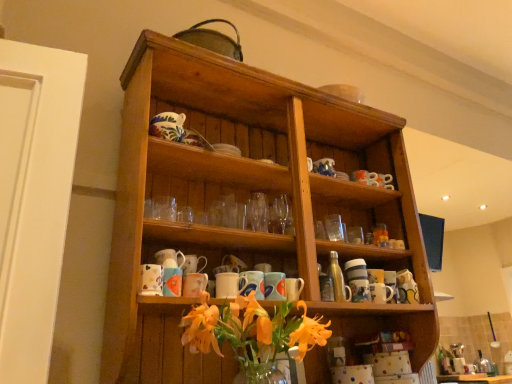
Question: Considering the positions of matte ceramic mug at center, arranged as the 4th mug when viewed from the right, and matte ceramic mug at center, positioned as the 1th mug in right-to-left order, in the image, is matte ceramic mug at center, arranged as the 4th mug when viewed from the right, taller or shorter than matte ceramic mug at center, positioned as the 1th mug in right-to-left order,?

Choices:
 (A) tall
 (B) short

Answer: (B)

Question: In the image, is matte ceramic mug at center, which is the 4th mug in left-to-right order, positioned in front of or behind matte ceramic mug at center, which ranks as the 7th mug in left-to-right order?

Choices:
 (A) front
 (B) behind

Answer: (A)

Question: Which is nearer to the matte ceramic mug at center, positioned as the 1th mug in right-to-left order?

Choices:
 (A) matte ceramic mug at center, the 5th mug in the left-to-right sequence
 (B) matte ceramic mug at center, which is the 4th mug in left-to-right order
 (C) matte ceramic mug at center, placed as the third mug when sorted from left to right
 (D) matte ceramic mug at center, acting as the sixth mug starting from the left
 (E) metallic silver bottle at center-right

Answer: (E)

Question: Which of these objects is positioned closest to the matte ceramic mug at lower center, the seventh mug when ordered from right to left?

Choices:
 (A) metallic silver bottle at center-right
 (B) wooden shelf at center
 (C) matte ceramic mug at center, which ranks as the 7th mug in left-to-right order
 (D) matte ceramic mug at center, acting as the third mug starting from the right
 (E) matte ceramic mug at center, placed as the third mug when sorted from left to right

Answer: (E)